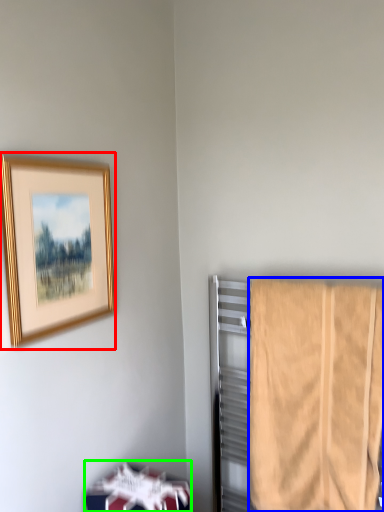
Question: Which object is positioned farthest from picture frame (highlighted by a red box)? Select from towel (highlighted by a blue box) and furniture (highlighted by a green box).

Choices:
 (A) towel
 (B) furniture

Answer: (A)